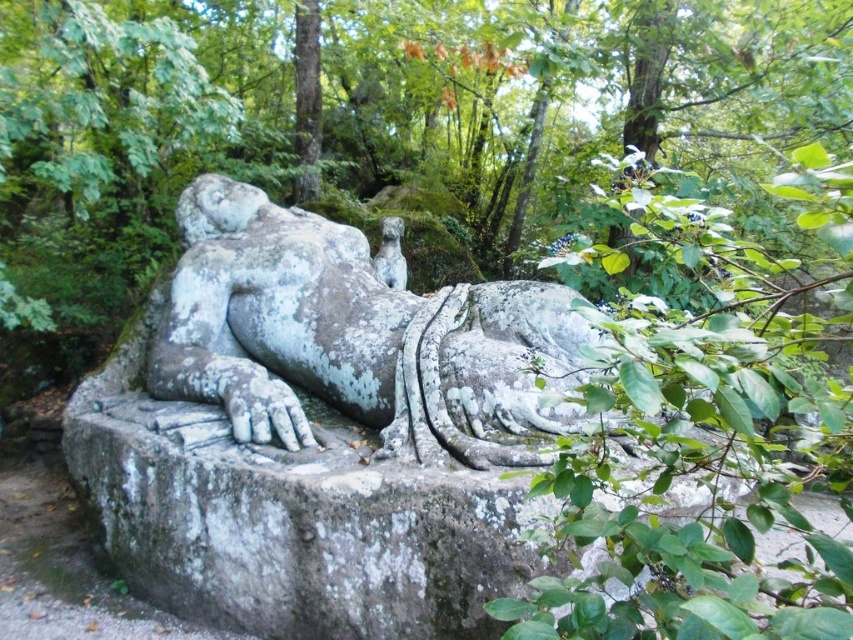
Does point (486, 413) come behind point (392, 253)?

No, (486, 413) is closer to viewer.

The height and width of the screenshot is (640, 853). What do you see at coordinates (357, 339) in the screenshot? I see `gray stone statue at center` at bounding box center [357, 339].

Between point (299, 348) and point (393, 262), which one is positioned behind?

Point (393, 262)

This screenshot has width=853, height=640. Identify the location of gray stone statue at center. (357, 339).